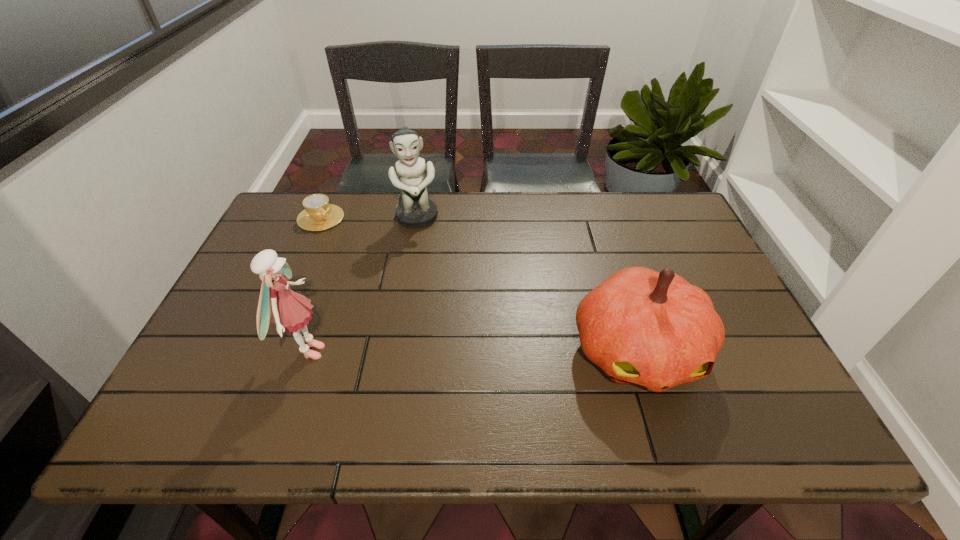
In order to click on vacant spot on the desktop that is between the doll and the third tallest object and is positioned on the front-facing side of the figurine in this screenshot , I will do `click(435, 352)`.

The height and width of the screenshot is (540, 960). In order to click on free space on the desktop that is between the doll and the second shortest object and is positioned with the handle on the side of the cup in this screenshot , I will do `click(437, 352)`.